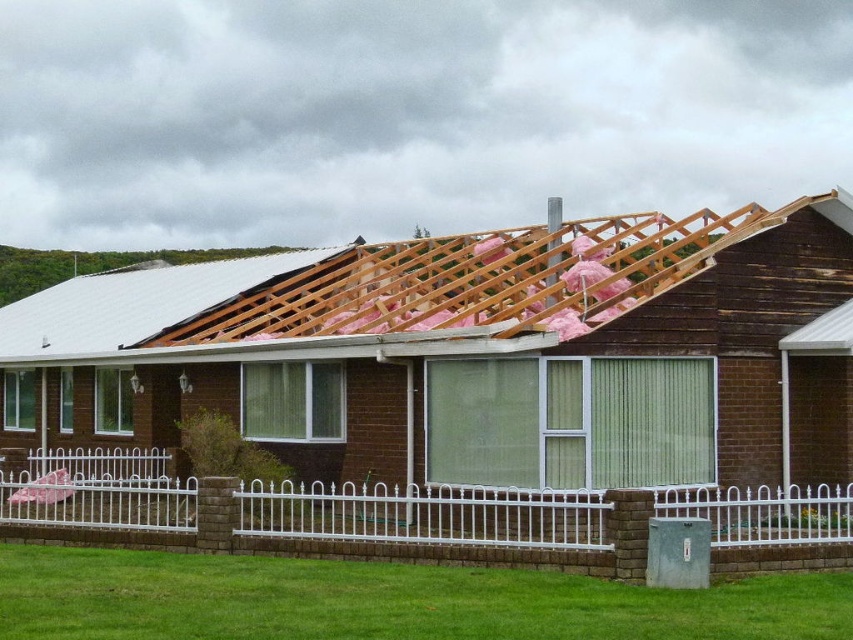
You are a contractor looking at the roof area of the house. You need to access the wooden beams at upper center to inspect them. The white metal fence at lower center is in your way. Can you move around the fence to reach the beams?

The wooden beams at upper center are in front of the white metal fence at lower center, meaning the fence is closer to you than the beams. Therefore, you can move around the fence to access the wooden beams at upper center.

You are a contractor assessing the roof structure. You notice the wooden beams at upper center and the white metal fence at lower center. Which object is bigger in size?

The wooden beams at upper center has a larger size compared to the white metal fence at lower center.

You are a construction worker standing at the edge of the roof. You need to move a tool from the wooden beams at upper center to the white metal fence at lower center. In which direction should you move the tool to place it correctly?

The wooden beams at upper center is positioned on the left side of white metal fence at lower center, so you should move the tool to the right to place it correctly.